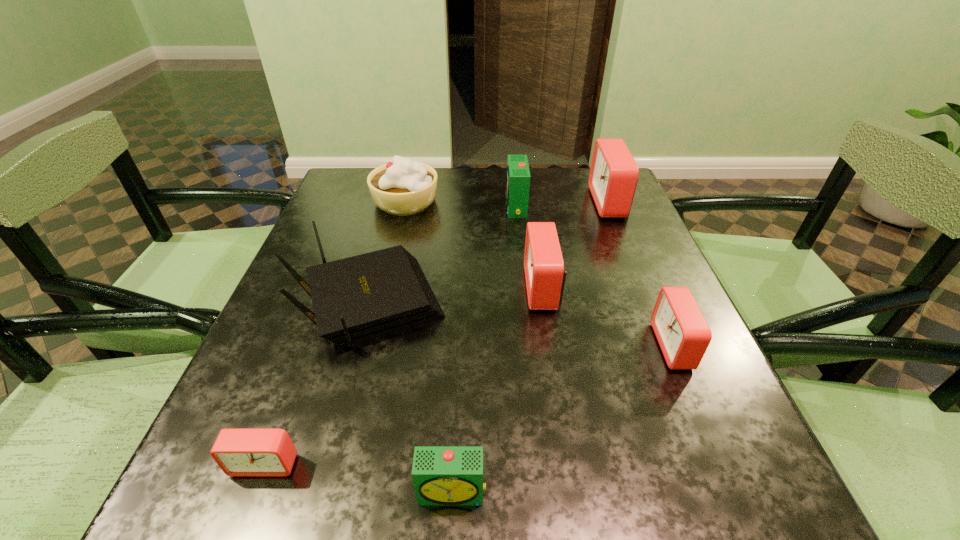
At what (x,y) coordinates should I click in order to perform the action: click on whipped cream located in the left edge section of the desktop. Please return your answer as a coordinate pair (x, y). This screenshot has width=960, height=540. Looking at the image, I should click on (402, 187).

Locate an element on the screen. The image size is (960, 540). router that is at the left edge is located at coordinates (356, 299).

Find the location of a particular element. alarm clock positioned at the left edge is located at coordinates (239, 452).

This screenshot has height=540, width=960. I want to click on object located at the far left corner, so click(x=402, y=187).

You are a GUI agent. You are given a task and a screenshot of the screen. Output one action in this format:
    pyautogui.click(x=<x>, y=<y>)
    Task: Click on the object at the near left corner
    
    Given the screenshot: What is the action you would take?
    pyautogui.click(x=239, y=452)

Where is `object positioned at the far right corner`? This screenshot has height=540, width=960. object positioned at the far right corner is located at coordinates click(613, 175).

In the image, there is a desktop. Identify the location of free region at the far edge. The height and width of the screenshot is (540, 960). (462, 171).

Identify the location of free space at the left edge of the desktop. This screenshot has width=960, height=540. (315, 264).

Locate an element on the screen. free space at the right edge of the desktop is located at coordinates (649, 275).

At what (x,y) coordinates should I click in order to perform the action: click on vacant region at the near left corner of the desktop. Please return your answer as a coordinate pair (x, y). The width and height of the screenshot is (960, 540). Looking at the image, I should click on pyautogui.click(x=231, y=479).